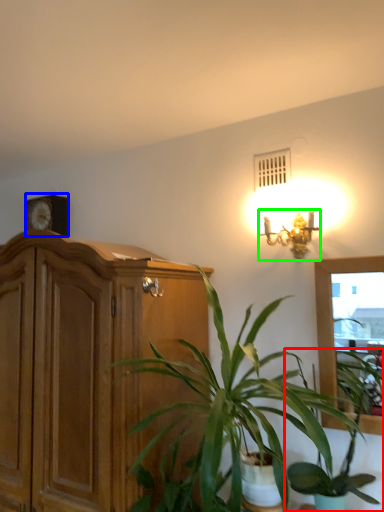
Question: Considering the real-world distances, which object is closest to houseplant (highlighted by a red box)? clock (highlighted by a blue box) or lamp (highlighted by a green box).

Choices:
 (A) clock
 (B) lamp

Answer: (B)